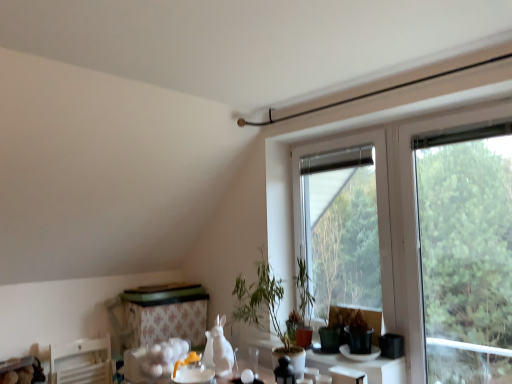
Question: Would you say transparent glass window at center is to the left or to the right of floral-patterned fabric at lower center in the picture?

Choices:
 (A) right
 (B) left

Answer: (A)

Question: Considering the positions of transparent glass window at center and floral-patterned fabric at lower center in the image, is transparent glass window at center wider or thinner than floral-patterned fabric at lower center?

Choices:
 (A) wide
 (B) thin

Answer: (B)

Question: Which is nearer to the green matte plant at center?

Choices:
 (A) floral-patterned fabric at lower center
 (B) transparent glass vase at lower center
 (C) green leafy tree at right
 (D) transparent glass window at center

Answer: (B)

Question: Which of these objects is positioned closest to the transparent glass window at center?

Choices:
 (A) green matte plant at center
 (B) green leafy tree at right
 (C) transparent glass vase at lower center
 (D) floral-patterned fabric at lower center

Answer: (B)